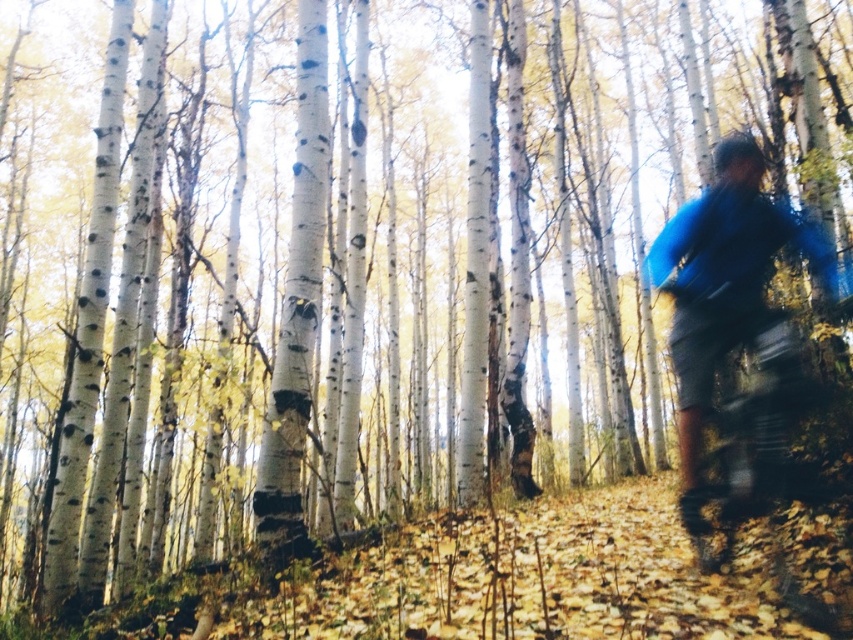
You are standing in the forest and see two points marked on the ground. One is at point (735,163) and the other at point (761,369). Which point is closer to you?

Point (761,369) is closer to you because it is less further to the camera than point (735,163).